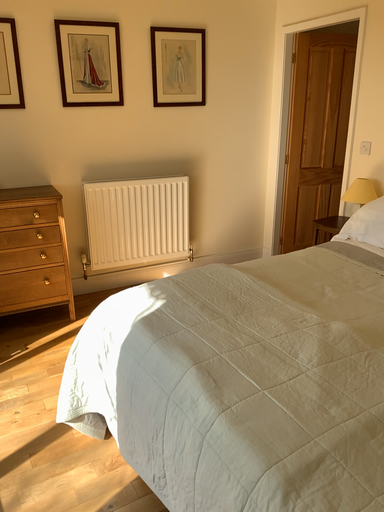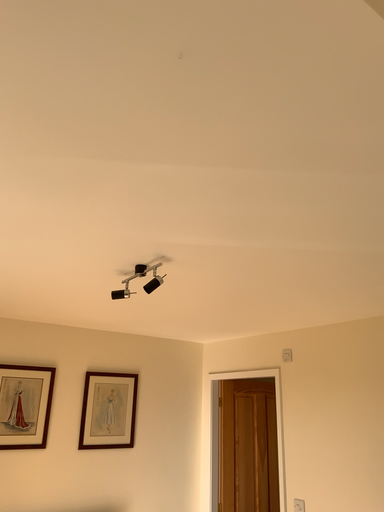
Question: Which way did the camera rotate in the video?

Choices:
 (A) rotated upward
 (B) rotated downward

Answer: (A)